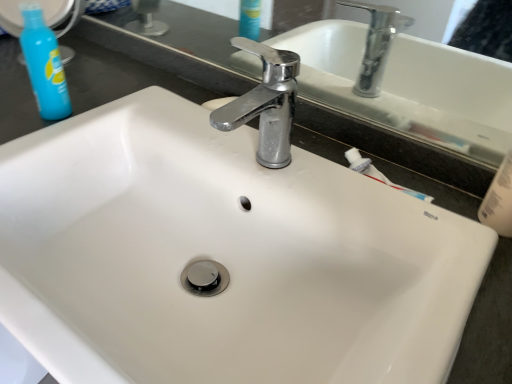
Question: Could you tell me if chrome metallic faucet at center is turned towards blue plastic bottle at upper left?

Choices:
 (A) no
 (B) yes

Answer: (A)

Question: Does chrome metallic faucet at center have a larger size compared to blue plastic bottle at upper left?

Choices:
 (A) no
 (B) yes

Answer: (B)

Question: Would you say blue plastic bottle at upper left is part of chrome metallic faucet at center's contents?

Choices:
 (A) no
 (B) yes

Answer: (A)

Question: Considering the relative positions of chrome metallic faucet at center and blue plastic bottle at upper left in the image provided, is chrome metallic faucet at center to the right of blue plastic bottle at upper left from the viewer's perspective?

Choices:
 (A) no
 (B) yes

Answer: (B)

Question: Considering the relative sizes of chrome metallic faucet at center and blue plastic bottle at upper left in the image provided, is chrome metallic faucet at center shorter than blue plastic bottle at upper left?

Choices:
 (A) no
 (B) yes

Answer: (B)

Question: From the image's perspective, is chrome metallic faucet at center on top of blue plastic bottle at upper left?

Choices:
 (A) yes
 (B) no

Answer: (B)

Question: Considering the relative sizes of blue plastic bottle at upper left and chrome metallic faucet at center in the image provided, is blue plastic bottle at upper left shorter than chrome metallic faucet at center?

Choices:
 (A) no
 (B) yes

Answer: (A)

Question: From a real-world perspective, does blue plastic bottle at upper left stand above chrome metallic faucet at center?

Choices:
 (A) no
 (B) yes

Answer: (A)

Question: Does blue plastic bottle at upper left have a lesser width compared to chrome metallic faucet at center?

Choices:
 (A) no
 (B) yes

Answer: (B)

Question: Is blue plastic bottle at upper left at the right side of chrome metallic faucet at center?

Choices:
 (A) no
 (B) yes

Answer: (A)

Question: Considering the relative positions of blue plastic bottle at upper left and chrome metallic faucet at center in the image provided, is blue plastic bottle at upper left to the left of chrome metallic faucet at center from the viewer's perspective?

Choices:
 (A) yes
 (B) no

Answer: (A)

Question: Considering the relative sizes of blue plastic bottle at upper left and chrome metallic faucet at center in the image provided, is blue plastic bottle at upper left smaller than chrome metallic faucet at center?

Choices:
 (A) no
 (B) yes

Answer: (B)

Question: From a real-world perspective, relative to blue plastic bottle at upper left, is chrome metallic faucet at center vertically above or below?

Choices:
 (A) below
 (B) above

Answer: (B)